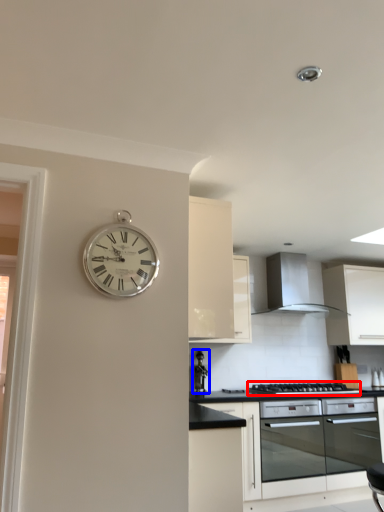
Question: Which point is further to the camera, gas stove (highlighted by a red box) or appliance (highlighted by a blue box)?

Choices:
 (A) gas stove
 (B) appliance

Answer: (B)